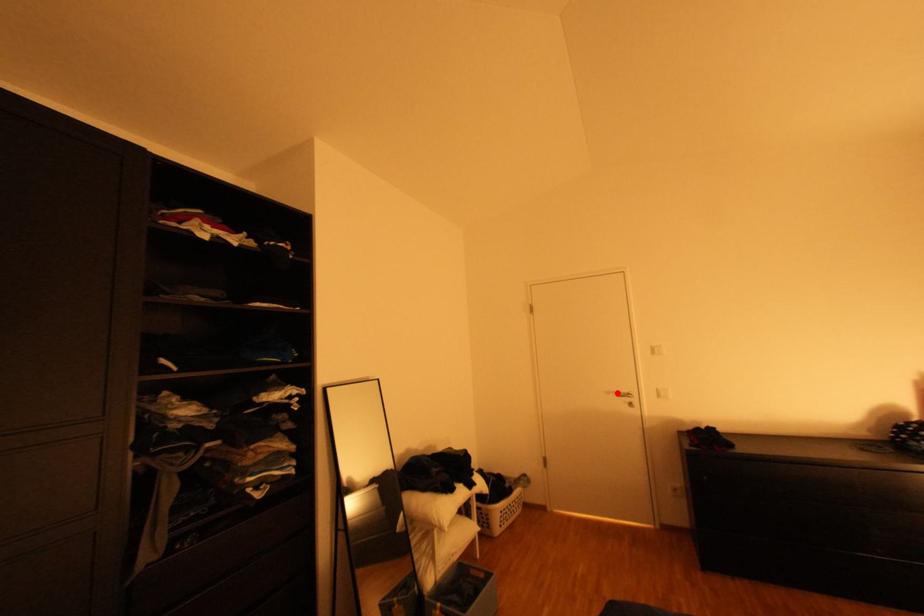
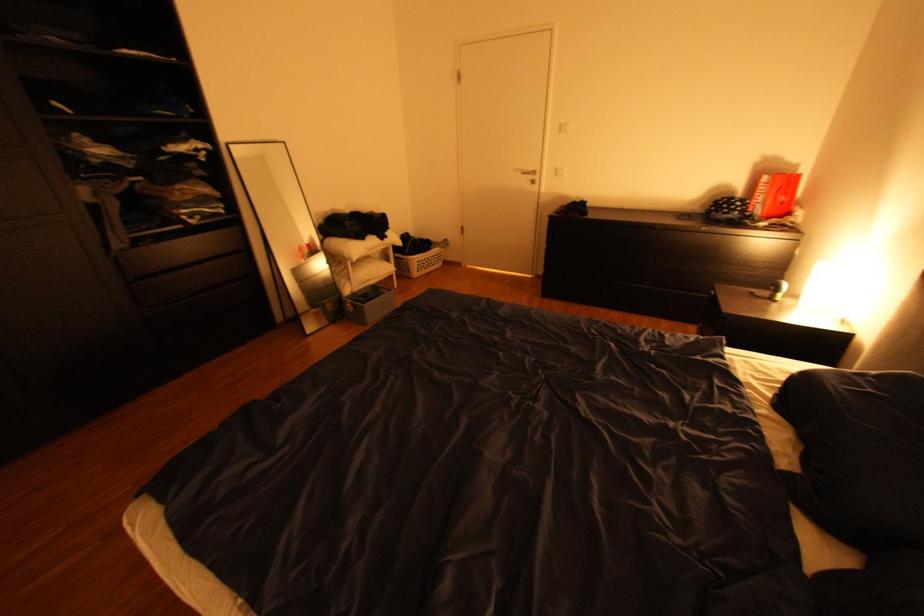
Question: A red point is marked in image1. In image2, is the corresponding 3D point closer to the camera or farther? Reply with the corresponding letter.

Choices:
 (A) The corresponding 3D point is closer.
 (B) The corresponding 3D point is farther.

Answer: (A)